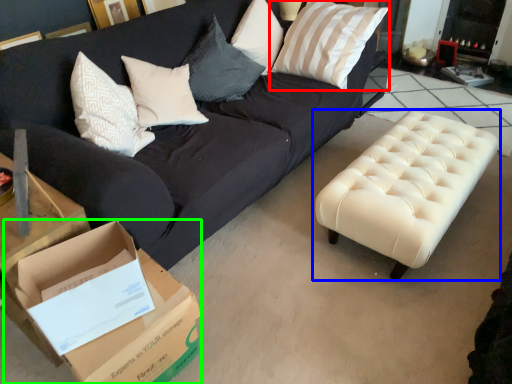
Question: Which object is the closest to the pillow (highlighted by a red box)? Choose among these: table (highlighted by a blue box) or cardboard box (highlighted by a green box).

Choices:
 (A) table
 (B) cardboard box

Answer: (A)